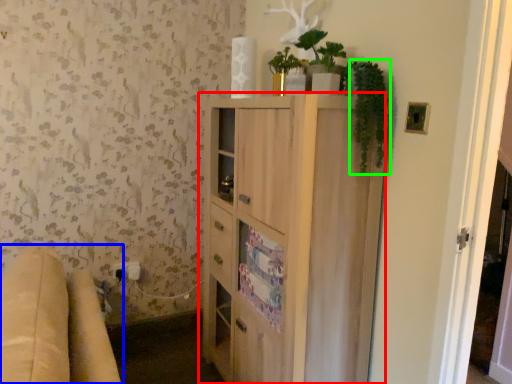
Question: Which is farther away from cabinetry (highlighted by a red box)? studio couch (highlighted by a blue box) or plant (highlighted by a green box)?

Choices:
 (A) studio couch
 (B) plant

Answer: (A)